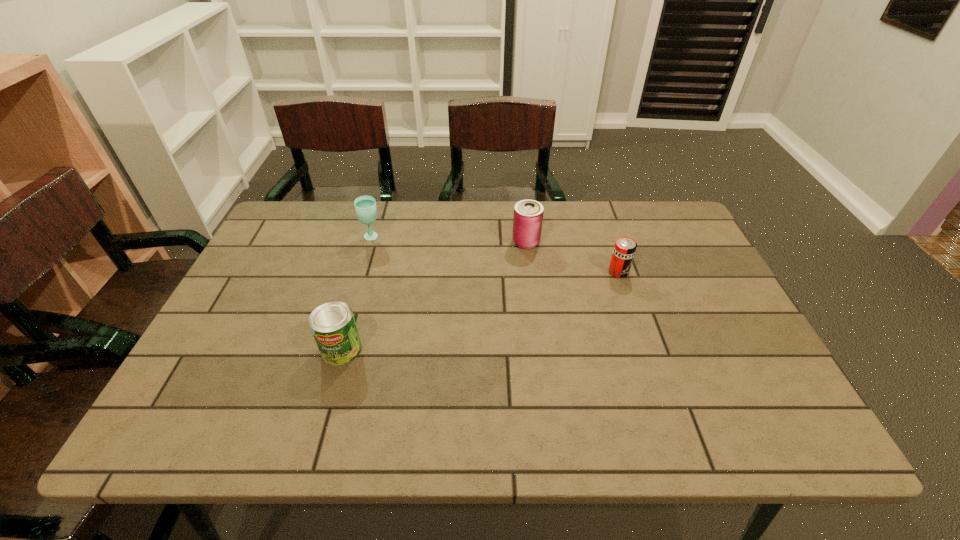
Find the location of `glass`. glass is located at coordinates (365, 206).

Where is `the farthest can`? The height and width of the screenshot is (540, 960). the farthest can is located at coordinates (528, 214).

You are a GUI agent. You are given a task and a screenshot of the screen. Output one action in this format:
    pyautogui.click(x=<x>, y=<y>)
    Task: Click on the second can from right to left
    The width and height of the screenshot is (960, 540).
    Given the screenshot: What is the action you would take?
    pyautogui.click(x=528, y=214)

Locate an element on the screen. Image resolution: width=960 pixels, height=540 pixels. the nearest object is located at coordinates (333, 325).

Locate an element on the screen. The height and width of the screenshot is (540, 960). the nearest can is located at coordinates (333, 325).

In order to click on the rightmost can in this screenshot , I will do click(624, 249).

The width and height of the screenshot is (960, 540). In order to click on the third farthest object in this screenshot , I will do `click(624, 249)`.

Where is `vacant space located 0.090m on the right of the glass`? The width and height of the screenshot is (960, 540). vacant space located 0.090m on the right of the glass is located at coordinates (412, 238).

At what (x,y) coordinates should I click in order to perform the action: click on free spot located on the front of the second can from right to left. Please return your answer as a coordinate pair (x, y). Looking at the image, I should click on (539, 342).

Where is `vacant space located 0.170m on the back of the nearest can`? vacant space located 0.170m on the back of the nearest can is located at coordinates (x=360, y=285).